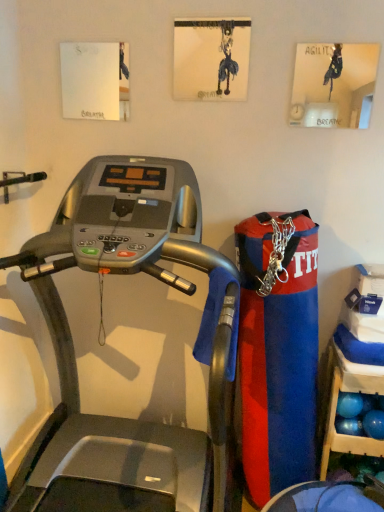
What is the approximate width of blue plastic shelf at lower right?

The width of blue plastic shelf at lower right is 12.11 inches.

What do you see at coordinates (344, 435) in the screenshot? Image resolution: width=384 pixels, height=512 pixels. I see `blue plastic shelf at lower right` at bounding box center [344, 435].

What are the coordinates of `blue plastic shelf at lower right` in the screenshot? It's located at (344, 435).

You are a GUI agent. You are given a task and a screenshot of the screen. Output one action in this format:
    pyautogui.click(x=<x>, y=<y>)
    Task: Click on the silver metallic treadmill at center
    The height and width of the screenshot is (512, 384).
    Given the screenshot: What is the action you would take?
    click(104, 337)

What do you see at coordinates (104, 337) in the screenshot? This screenshot has height=512, width=384. I see `silver metallic treadmill at center` at bounding box center [104, 337].

At what (x,y) coordinates should I click in order to perform the action: click on blue plastic shelf at lower right. Please return your answer as a coordinate pair (x, y). Looking at the image, I should click on (344, 435).

Considering the positions of objects blue plastic shelf at lower right and silver metallic treadmill at center in the image provided, who is more to the right, blue plastic shelf at lower right or silver metallic treadmill at center?

blue plastic shelf at lower right.

Which object is further away from the camera taking this photo, blue plastic shelf at lower right or silver metallic treadmill at center?

blue plastic shelf at lower right is further from the camera.

Considering the positions of points (360, 443) and (219, 403), is point (360, 443) closer to camera compared to point (219, 403)?

Yes, point (360, 443) is closer to viewer.

Consider the image. From the image's perspective, which is above, blue plastic shelf at lower right or silver metallic treadmill at center?

silver metallic treadmill at center appears higher in the image.

From a real-world perspective, which is physically below, blue plastic shelf at lower right or silver metallic treadmill at center?

From a 3D spatial view, blue plastic shelf at lower right is below.

Is blue plastic shelf at lower right thinner than silver metallic treadmill at center?

Indeed, blue plastic shelf at lower right has a lesser width compared to silver metallic treadmill at center.

Considering the relative sizes of blue plastic shelf at lower right and silver metallic treadmill at center in the image provided, is blue plastic shelf at lower right shorter than silver metallic treadmill at center?

Yes.

Which of these two, blue plastic shelf at lower right or silver metallic treadmill at center, is smaller?

With smaller size is blue plastic shelf at lower right.

Would you say blue plastic shelf at lower right is outside silver metallic treadmill at center?

blue plastic shelf at lower right lies outside silver metallic treadmill at center's area.

Is there a large distance between blue plastic shelf at lower right and silver metallic treadmill at center?

No, blue plastic shelf at lower right is not far away from silver metallic treadmill at center.

Is blue plastic shelf at lower right oriented towards silver metallic treadmill at center?

No, blue plastic shelf at lower right is not oriented towards silver metallic treadmill at center.

At what (x,y) coordinates should I click in order to perform the action: click on treadmill to the left of blue plastic shelf at lower right. Please return your answer as a coordinate pair (x, y). The width and height of the screenshot is (384, 512). Looking at the image, I should click on (104, 337).

From the picture: Which is more to the right, silver metallic treadmill at center or blue plastic shelf at lower right?

blue plastic shelf at lower right is more to the right.

Who is more distant, silver metallic treadmill at center or blue plastic shelf at lower right?

blue plastic shelf at lower right.

Which is nearer, (195, 250) or (342, 381)?

Point (195, 250) is closer to the camera than point (342, 381).

From the image's perspective, between silver metallic treadmill at center and blue plastic shelf at lower right, who is located below?

blue plastic shelf at lower right appears lower in the image.

From a real-world perspective, is silver metallic treadmill at center located beneath blue plastic shelf at lower right?

No, from a real-world perspective, silver metallic treadmill at center is not under blue plastic shelf at lower right.

Looking at their sizes, would you say silver metallic treadmill at center is wider or thinner than blue plastic shelf at lower right?

In the image, silver metallic treadmill at center appears to be wider than blue plastic shelf at lower right.

Does silver metallic treadmill at center have a lesser height compared to blue plastic shelf at lower right?

No, silver metallic treadmill at center is not shorter than blue plastic shelf at lower right.

Considering the sizes of objects silver metallic treadmill at center and blue plastic shelf at lower right in the image provided, who is bigger, silver metallic treadmill at center or blue plastic shelf at lower right?

silver metallic treadmill at center.

Is silver metallic treadmill at center inside the boundaries of blue plastic shelf at lower right, or outside?

silver metallic treadmill at center exists outside the volume of blue plastic shelf at lower right.

Is silver metallic treadmill at center positioned far away from blue plastic shelf at lower right?

That's not correct — silver metallic treadmill at center is a little close to blue plastic shelf at lower right.

Based on the photo, is silver metallic treadmill at center positioned with its back to blue plastic shelf at lower right?

No, silver metallic treadmill at center's orientation is not away from blue plastic shelf at lower right.

How different are the orientations of silver metallic treadmill at center and blue plastic shelf at lower right in degrees?

1.18 degrees.

In the image, there is a silver metallic treadmill at center. Where is `shelf below it (from a real-world perspective)`? The height and width of the screenshot is (512, 384). shelf below it (from a real-world perspective) is located at coordinates (344, 435).

Image resolution: width=384 pixels, height=512 pixels. I want to click on shelf below the silver metallic treadmill at center (from a real-world perspective), so click(x=344, y=435).

This screenshot has height=512, width=384. I want to click on shelf on the right of silver metallic treadmill at center, so click(344, 435).